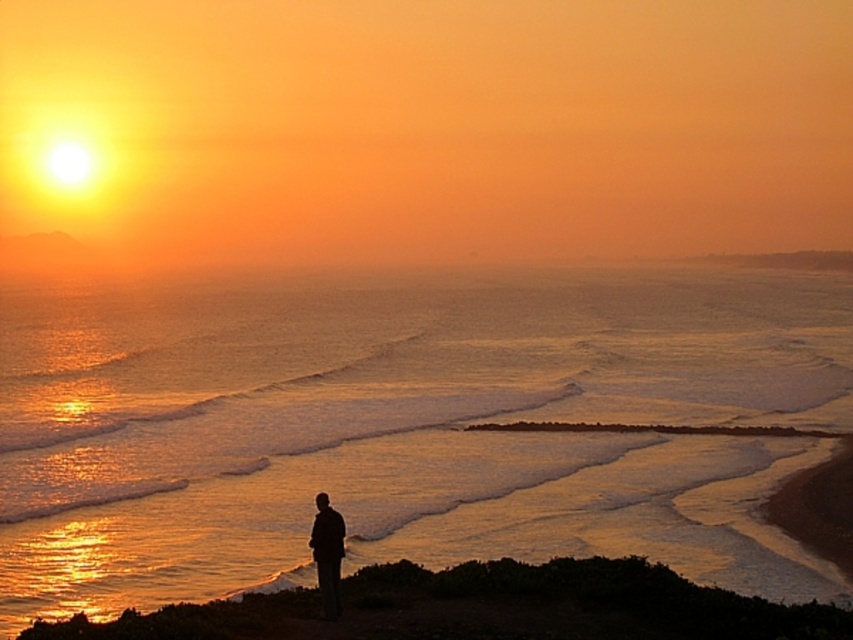
Question: Which point is closer to the camera?

Choices:
 (A) smooth sand shoreline at lower center
 (B) silhouette figure at lower center
 (C) glistening water at center

Answer: (A)

Question: Is glistening water at center to the right of silhouette figure at lower center from the viewer's perspective?

Choices:
 (A) no
 (B) yes

Answer: (A)

Question: Is glistening water at center to the right of silhouette figure at lower center from the viewer's perspective?

Choices:
 (A) yes
 (B) no

Answer: (B)

Question: In this image, where is glistening water at center located relative to silhouette figure at lower center?

Choices:
 (A) right
 (B) left

Answer: (B)

Question: Among these points, which one is nearest to the camera?

Choices:
 (A) (309, 596)
 (B) (77, 468)

Answer: (A)

Question: Which object is closer to the camera taking this photo?

Choices:
 (A) silhouette figure at lower center
 (B) glistening water at center
 (C) smooth sand shoreline at lower center

Answer: (C)